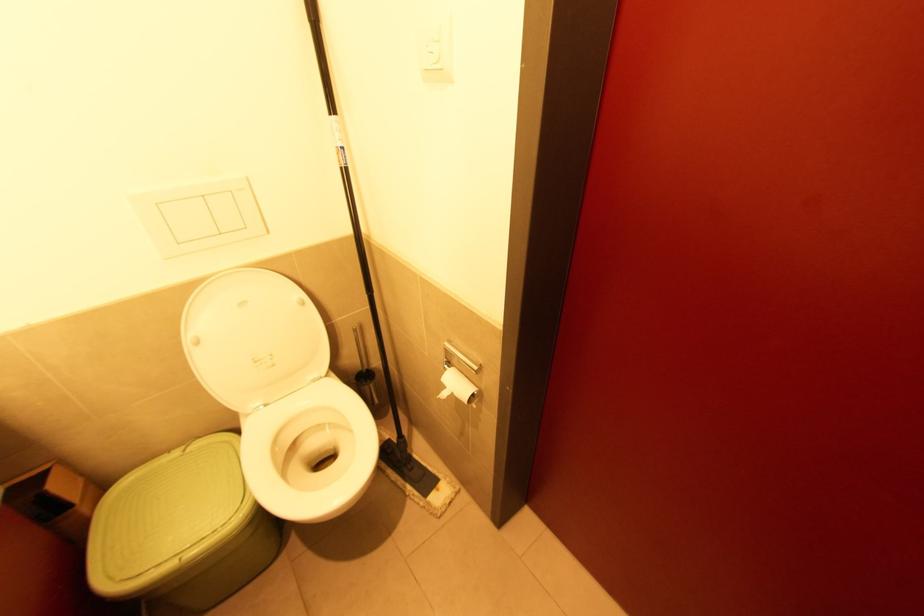
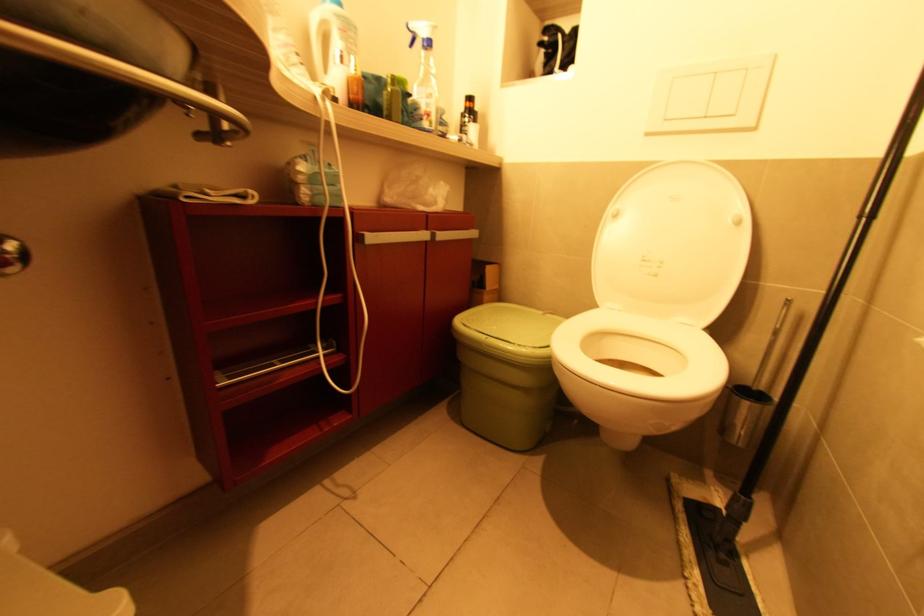
Find the pixel in the second image that matches the point at 224,235 in the first image.

(709, 118)